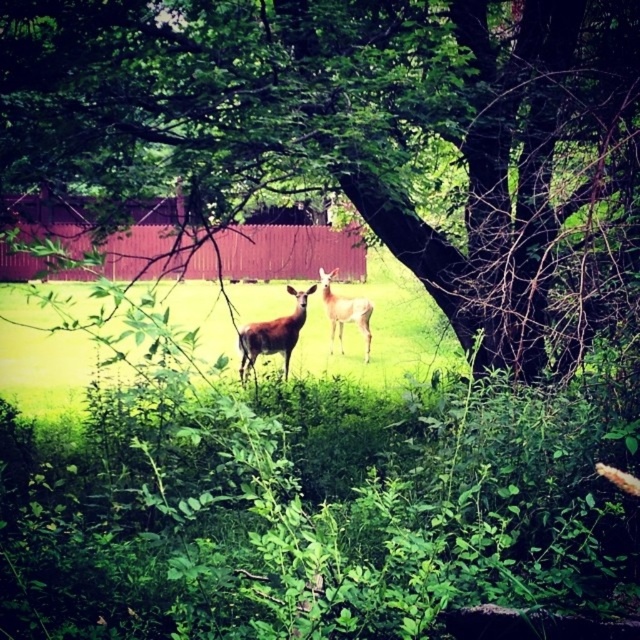
Question: Which object is positioned closest to the brown velvet deer at center?

Choices:
 (A) green leafy tree at center
 (B) light brown fur at center

Answer: (B)

Question: Can you confirm if green leafy tree at center is positioned to the right of brown velvet deer at center?

Choices:
 (A) yes
 (B) no

Answer: (A)

Question: Is green leafy tree at center wider than light brown fur at center?

Choices:
 (A) no
 (B) yes

Answer: (A)

Question: Which object is the farthest from the brown velvet deer at center?

Choices:
 (A) green leafy tree at center
 (B) light brown fur at center

Answer: (A)

Question: Among these points, which one is farthest from the camera?

Choices:
 (A) (278, 324)
 (B) (323, 292)

Answer: (B)

Question: Is green leafy tree at center below light brown fur at center?

Choices:
 (A) no
 (B) yes

Answer: (A)